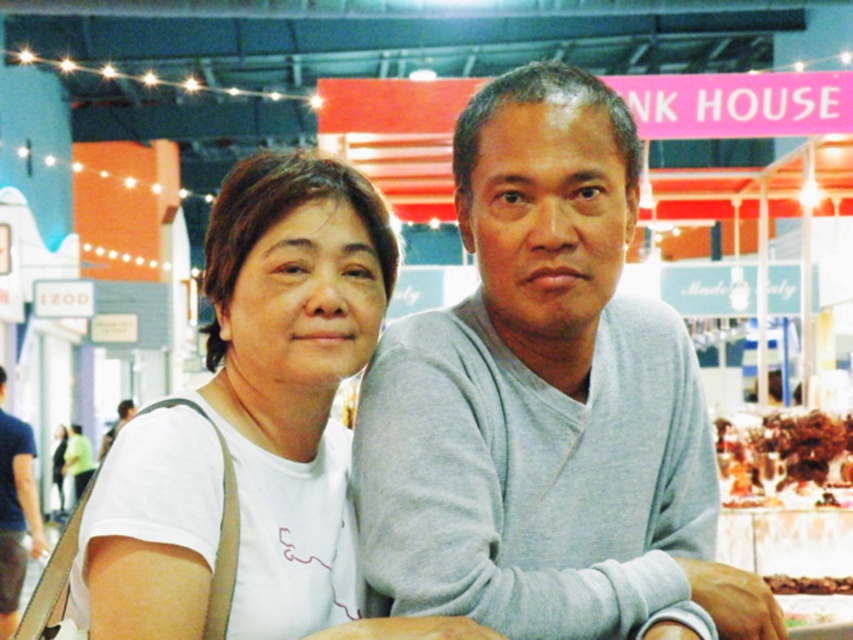
Is brown crumbly bread at lower right taller than yellow matte cake at center?

Yes.

Is brown crumbly bread at lower right wider than yellow matte cake at center?

Yes, brown crumbly bread at lower right is wider than yellow matte cake at center.

Is point (730, 454) closer to viewer compared to point (422, 621)?

No, (730, 454) is behind (422, 621).

Identify the location of brown crumbly bread at lower right. Image resolution: width=853 pixels, height=640 pixels. (782, 458).

Which of these two, gray cotton sweater at center or yellow matte cake at center, stands shorter?

With less height is yellow matte cake at center.

Is gray cotton sweater at center thinner than yellow matte cake at center?

No.

Does point (546, 324) lie in front of point (473, 621)?

No, (546, 324) is behind (473, 621).

I want to click on gray cotton sweater at center, so click(x=546, y=403).

Identify the location of brown crumbly bread at lower right. (782, 458).

Based on the photo, can you confirm if brown crumbly bread at lower right is positioned to the right of blue cotton t-shirt at left?

Yes, brown crumbly bread at lower right is to the right of blue cotton t-shirt at left.

You are a GUI agent. You are given a task and a screenshot of the screen. Output one action in this format:
    pyautogui.click(x=<x>, y=<y>)
    Task: Click on the brown crumbly bread at lower right
    This screenshot has width=853, height=640.
    Given the screenshot: What is the action you would take?
    pyautogui.click(x=782, y=458)

Where is `brown crumbly bread at lower right`? This screenshot has height=640, width=853. brown crumbly bread at lower right is located at coordinates (782, 458).